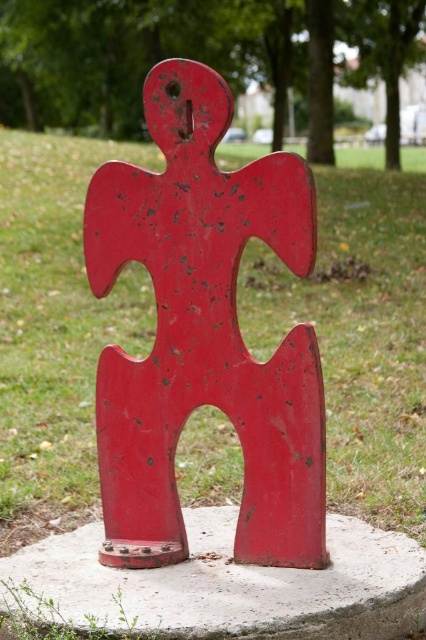
You are standing at the edge of the circular concrete platform where the red metal sculpture is placed. You want to walk directly towards the green grass at center. Which direction should you face to head straight toward it?

To walk directly toward the green grass at center, you should face the direction indicated by the coordinates point at (359,332), which is the location of the green grass at center relative to your starting position on the platform.

Looking at this image, you are standing in front of the red metal sculpture on the concrete base. There is a point labeled as point (359, 332). What is the color of the area at that point?

The point (359, 332) corresponds to green grass at center.